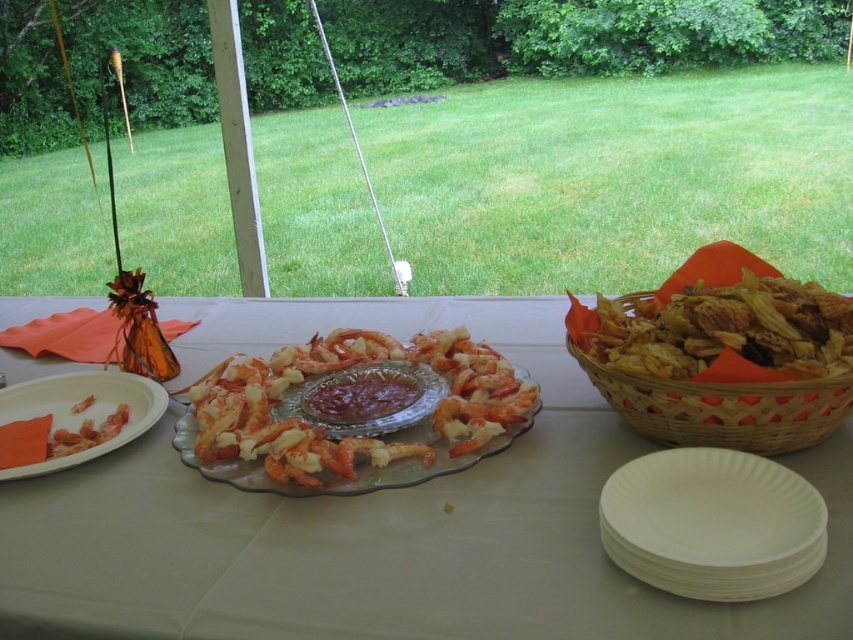
You are setting up a picnic basket and need to know which item can fit into a narrow space. Which object is thinner between the woven brown basket at right and the shiny glass platter at center?

The woven brown basket at right is thinner than the shiny glass platter at center, so it can fit into a narrow space.

You are setting up a picnic and need to place a cooler next to the woven brown basket at right without blocking the view of the table. Where should you position the cooler relative to the basket?

The woven brown basket at right is located at point (723, 406), so you should place the cooler to the left or behind the basket to avoid blocking the view of the table.

You are a guest at this outdoor gathering and want to serve yourself shrimp from the shiny glass platter at center. You have a white paper plates at lower right. Will the shrimp fit on your plate?

The white paper plates at lower right has a smaller size compared to shiny glass platter at center. Therefore, the shrimp may not fit comfortably on the plate, as the plate is smaller than the platter.